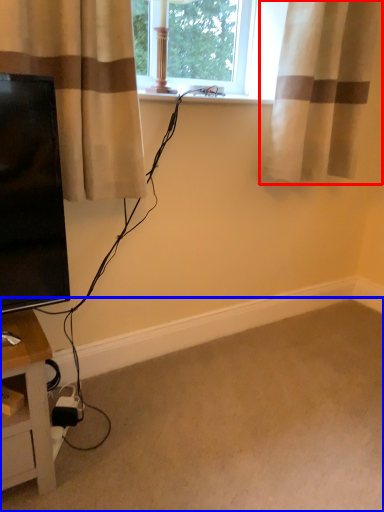
Question: Which point is closer to the camera, curtain (highlighted by a red box) or plain (highlighted by a blue box)?

Choices:
 (A) curtain
 (B) plain

Answer: (B)